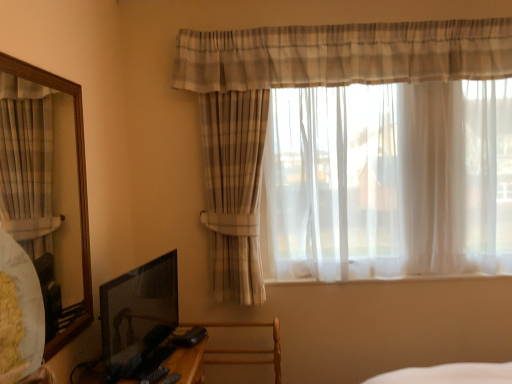
Question: Is matte black tv at lower left positioned behind wooden swivel chair at lower center?

Choices:
 (A) yes
 (B) no

Answer: (B)

Question: Does matte black tv at lower left have a greater width compared to wooden swivel chair at lower center?

Choices:
 (A) yes
 (B) no

Answer: (B)

Question: Could you tell me if matte black tv at lower left is facing wooden swivel chair at lower center?

Choices:
 (A) no
 (B) yes

Answer: (A)

Question: Is matte black tv at lower left not near wooden swivel chair at lower center?

Choices:
 (A) yes
 (B) no

Answer: (B)

Question: From the image's perspective, is matte black tv at lower left located beneath wooden swivel chair at lower center?

Choices:
 (A) yes
 (B) no

Answer: (B)

Question: Based on their sizes in the image, would you say wooden swivel chair at lower center is bigger or smaller than matte black tv at lower left?

Choices:
 (A) big
 (B) small

Answer: (A)

Question: Based on their positions, is wooden swivel chair at lower center located to the left or right of matte black tv at lower left?

Choices:
 (A) right
 (B) left

Answer: (A)

Question: In the image, is wooden swivel chair at lower center positioned in front of or behind matte black tv at lower left?

Choices:
 (A) front
 (B) behind

Answer: (B)

Question: From a real-world perspective, is wooden swivel chair at lower center physically located above or below matte black tv at lower left?

Choices:
 (A) above
 (B) below

Answer: (B)

Question: Considering the relative positions of wooden swivel chair at lower center and plaid sheer curtain at upper center in the image provided, is wooden swivel chair at lower center to the left or to the right of plaid sheer curtain at upper center?

Choices:
 (A) left
 (B) right

Answer: (A)

Question: Does point (226, 360) appear closer or farther from the camera than point (422, 59)?

Choices:
 (A) closer
 (B) farther

Answer: (B)

Question: Is wooden swivel chair at lower center inside or outside of plaid sheer curtain at upper center?

Choices:
 (A) inside
 (B) outside

Answer: (B)

Question: From their relative heights in the image, would you say wooden swivel chair at lower center is taller or shorter than plaid sheer curtain at upper center?

Choices:
 (A) short
 (B) tall

Answer: (A)

Question: Is plaid sheer curtain at upper center inside or outside of wooden swivel chair at lower center?

Choices:
 (A) outside
 (B) inside

Answer: (A)

Question: Is plaid sheer curtain at upper center bigger or smaller than wooden swivel chair at lower center?

Choices:
 (A) big
 (B) small

Answer: (A)